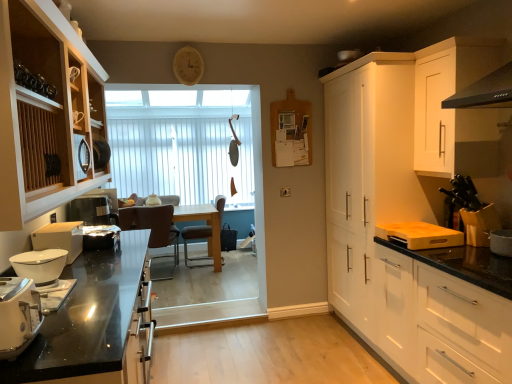
Where is `empty space that is ontop of white vertical blinds at center (from a real-world perspective)`? This screenshot has width=512, height=384. empty space that is ontop of white vertical blinds at center (from a real-world perspective) is located at coordinates (177, 107).